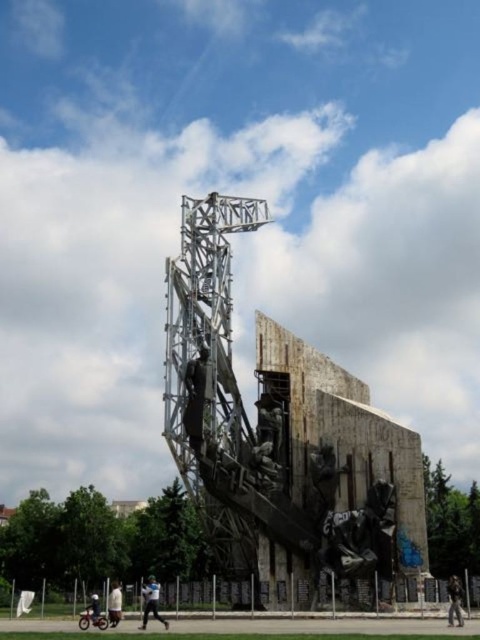
Does light blue shirt at center have a greater width compared to dark brown leather jacket at lower right?

Incorrect, light blue shirt at center's width does not surpass dark brown leather jacket at lower right's.

I want to click on light blue shirt at center, so click(152, 602).

Measure the distance from light blue shirt at center to dark blue jeans at lower left.

They are 5.95 meters apart.

Is light blue shirt at center above dark blue jeans at lower left?

Indeed, light blue shirt at center is positioned over dark blue jeans at lower left.

Where is `light blue shirt at center`? This screenshot has height=640, width=480. light blue shirt at center is located at coordinates (152, 602).

Which is below, light blue shirt at center or white cotton shirt at lower left?

white cotton shirt at lower left is below.

Can you confirm if light blue shirt at center is positioned below white cotton shirt at lower left?

Incorrect, light blue shirt at center is not positioned below white cotton shirt at lower left.

Is point (142, 618) farther from viewer compared to point (119, 609)?

Yes, point (142, 618) is behind point (119, 609).

Find the location of a particular element. light blue shirt at center is located at coordinates (152, 602).